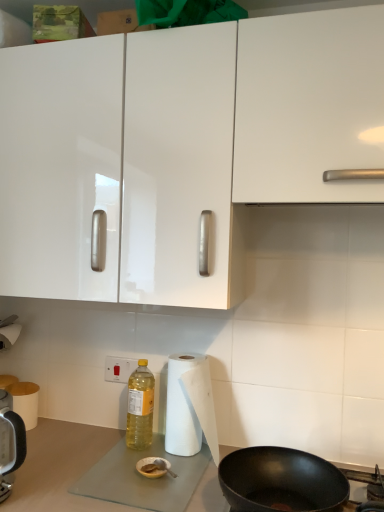
Question: Is yellow translucent bottle at lower center in front of or behind white glossy cabinet at upper center in the image?

Choices:
 (A) behind
 (B) front

Answer: (A)

Question: From their relative heights in the image, would you say yellow translucent bottle at lower center is taller or shorter than white glossy cabinet at upper center?

Choices:
 (A) short
 (B) tall

Answer: (A)

Question: Which object is the closest to the white plastic electric outlet at lower center?

Choices:
 (A) white glossy cabinet at upper center
 (B) white paper towel at lower left, which is counted as the first paper towel, starting from the left
 (C) white paper at lower center, the 1th paper towel from the front
 (D) yellow translucent bottle at lower center
 (E) black matte frying pan at lower right

Answer: (D)

Question: Estimate the real-world distances between objects in this image. Which object is closer to the black matte frying pan at lower right?

Choices:
 (A) white paper at lower center, which appears as the first paper towel when viewed from the right
 (B) white glossy cabinet at upper center
 (C) yellow translucent bottle at lower center
 (D) white plastic electric outlet at lower center
 (E) white paper towel at lower left, the 1th paper towel viewed from the back

Answer: (A)